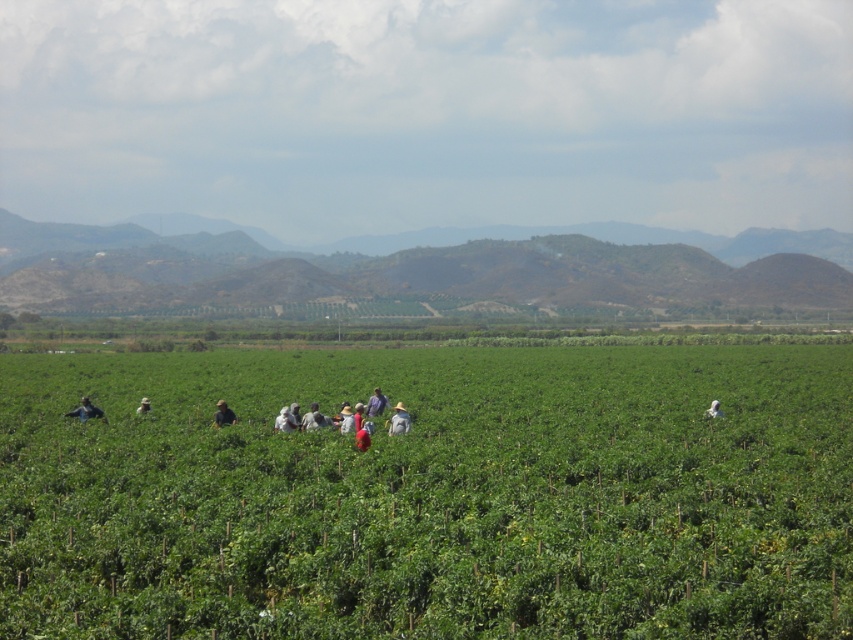
Question: Which object is the farthest from the dark blue shirt at lower left?

Choices:
 (A) light brown straw hat at center
 (B) camouflage fabric person at center
 (C) green leafy plants at center
 (D) light brown fabric hat at center

Answer: (C)

Question: Can you confirm if light brown fabric hat at center is positioned below white cotton shirt at center?

Choices:
 (A) yes
 (B) no

Answer: (B)

Question: From the image, what is the correct spatial relationship of white fabric hat at center in relation to dark blue shirt at lower left?

Choices:
 (A) left
 (B) right

Answer: (B)

Question: Which of the following is the farthest from the observer?

Choices:
 (A) (83, 413)
 (B) (367, 403)
 (C) (144, 412)
 (D) (396, 433)

Answer: (C)

Question: In this image, where is white fabric hat at center located relative to light brown straw hat at center?

Choices:
 (A) left
 (B) right

Answer: (B)

Question: Which object is the farthest from the white cotton shirt at center?

Choices:
 (A) light brown straw hat at center
 (B) dark blue shirt at lower left
 (C) green leafy plants at center

Answer: (C)